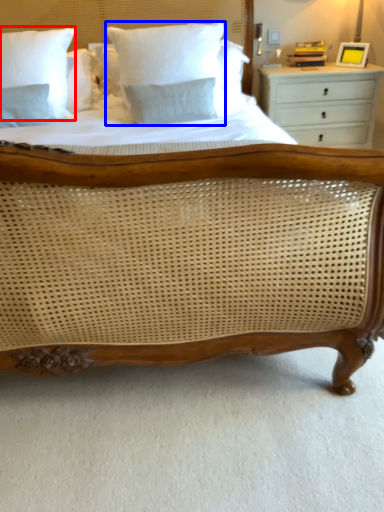
Question: Which object is closer to the camera taking this photo, pillow (highlighted by a red box) or pillow (highlighted by a blue box)?

Choices:
 (A) pillow
 (B) pillow

Answer: (B)